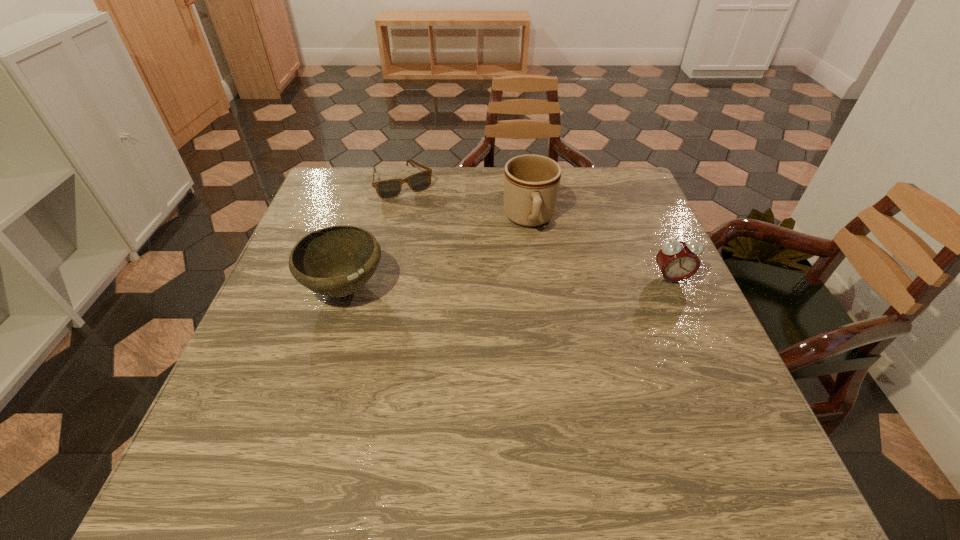
You are a GUI agent. You are given a task and a screenshot of the screen. Output one action in this format:
    pyautogui.click(x=<x>, y=<y>)
    Task: Click on the bowl
    
    Given the screenshot: What is the action you would take?
    pyautogui.click(x=336, y=261)

Identify the location of alarm clock. (677, 260).

Find the location of `sunglasses`. sunglasses is located at coordinates [386, 189].

Where is `mug`? mug is located at coordinates (531, 182).

Image resolution: width=960 pixels, height=540 pixels. Find the location of `free space located on the back of the bowl`. free space located on the back of the bowl is located at coordinates (367, 219).

Where is `vacant space located 0.340m on the clock face of the rightmost object`? The image size is (960, 540). vacant space located 0.340m on the clock face of the rightmost object is located at coordinates (735, 423).

Where is `vacant space located on the frames of the shortest object`? The image size is (960, 540). vacant space located on the frames of the shortest object is located at coordinates (432, 227).

Find the location of a particular element. This screenshot has height=540, width=960. vacant area located 0.110m on the frames of the shortest object is located at coordinates (426, 219).

Locate an element on the screen. The width and height of the screenshot is (960, 540). free space located on the frames of the shortest object is located at coordinates (437, 236).

Find the location of a particular element. Image resolution: width=960 pixels, height=540 pixels. vacant region located 0.360m on the side of the mug with the handle is located at coordinates (548, 358).